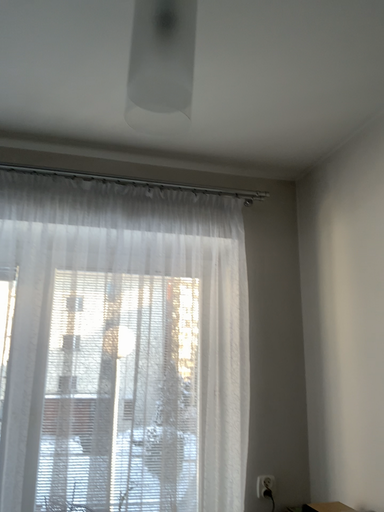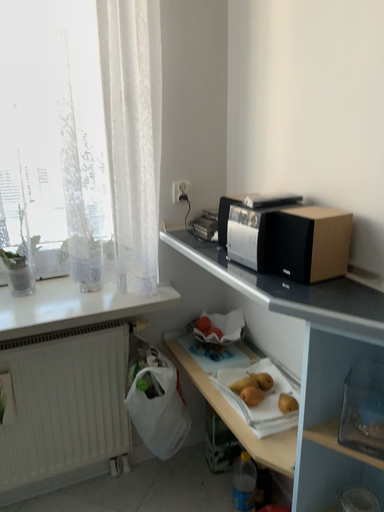
Question: How did the camera likely rotate when shooting the video?

Choices:
 (A) rotated right
 (B) rotated left

Answer: (A)